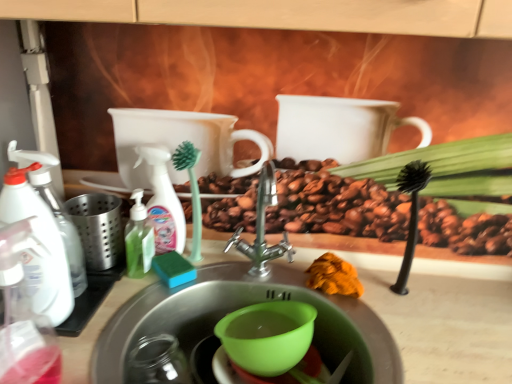
Question: From their relative heights in the image, would you say green plastic scrub brush at center, the second plant from the right, is taller or shorter than orange fabric at sink?

Choices:
 (A) tall
 (B) short

Answer: (A)

Question: In the image, is green plastic scrub brush at center, positioned as the 1th plant in left-to-right order, on the left side or the right side of orange fabric at sink?

Choices:
 (A) left
 (B) right

Answer: (A)

Question: Which of these objects is positioned closest to the green translucent pump bottle at left, placed as the 2th cleaning product when sorted from right to left?

Choices:
 (A) green plastic scrub brush at center, positioned as the 1th plant in left-to-right order
 (B) green plastic bowl at center
 (C) black plastic brush at right, which is counted as the first plant, starting from the right
 (D) green plastic bowl at sink
 (E) white plastic spray bottle at left, the 3th cleaning product from the right

Answer: (A)

Question: Which object is the farthest from the orange fabric at sink?

Choices:
 (A) green plastic spray bottle at center, positioned as the third cleaning product in left-to-right order
 (B) green plastic scrub brush at center, positioned as the 1th plant in left-to-right order
 (C) green plastic bowl at sink
 (D) black plastic brush at right, the 2th plant in the left-to-right sequence
 (E) green plastic bowl at center

Answer: (A)